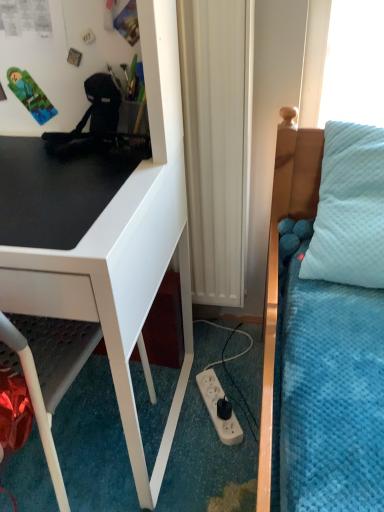
Question: Considering the relative sizes of white glossy desk at left and white plastic power outlet at lower center in the image provided, is white glossy desk at left shorter than white plastic power outlet at lower center?

Choices:
 (A) no
 (B) yes

Answer: (A)

Question: Is white glossy desk at left closer to the viewer compared to white plastic power outlet at lower center?

Choices:
 (A) no
 (B) yes

Answer: (B)

Question: Is white glossy desk at left looking in the opposite direction of white plastic power outlet at lower center?

Choices:
 (A) no
 (B) yes

Answer: (A)

Question: From a real-world perspective, is white glossy desk at left beneath white plastic power outlet at lower center?

Choices:
 (A) no
 (B) yes

Answer: (A)

Question: Is white glossy desk at left at the right side of white plastic power outlet at lower center?

Choices:
 (A) yes
 (B) no

Answer: (B)

Question: In terms of width, does white glossy desk at left look wider or thinner when compared to black matte desk at left?

Choices:
 (A) thin
 (B) wide

Answer: (B)

Question: Is white glossy desk at left taller or shorter than black matte desk at left?

Choices:
 (A) tall
 (B) short

Answer: (A)

Question: From a real-world perspective, is white glossy desk at left physically located above or below black matte desk at left?

Choices:
 (A) below
 (B) above

Answer: (A)

Question: Looking at the image, does white glossy desk at left seem bigger or smaller compared to black matte desk at left?

Choices:
 (A) small
 (B) big

Answer: (B)

Question: Considering the positions of white matte radiator at center and white glossy desk at left in the image, is white matte radiator at center wider or thinner than white glossy desk at left?

Choices:
 (A) thin
 (B) wide

Answer: (A)

Question: Relative to white glossy desk at left, is white matte radiator at center in front or behind?

Choices:
 (A) behind
 (B) front

Answer: (A)

Question: From the image's perspective, is white matte radiator at center located above or below white glossy desk at left?

Choices:
 (A) below
 (B) above

Answer: (B)

Question: Considering the relative positions of white matte radiator at center and white glossy desk at left in the image provided, is white matte radiator at center to the left or to the right of white glossy desk at left?

Choices:
 (A) left
 (B) right

Answer: (B)

Question: Is white glossy desk at left wider or thinner than white matte radiator at center?

Choices:
 (A) wide
 (B) thin

Answer: (A)

Question: Would you say white glossy desk at left is to the left or to the right of white matte radiator at center in the picture?

Choices:
 (A) right
 (B) left

Answer: (B)